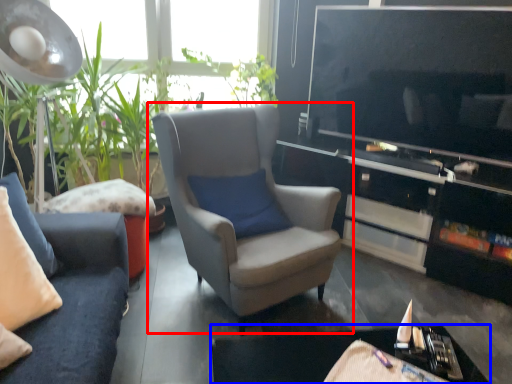
Question: Among these objects, which one is nearest to the camera, chair (highlighted by a red box) or table (highlighted by a blue box)?

Choices:
 (A) chair
 (B) table

Answer: (B)